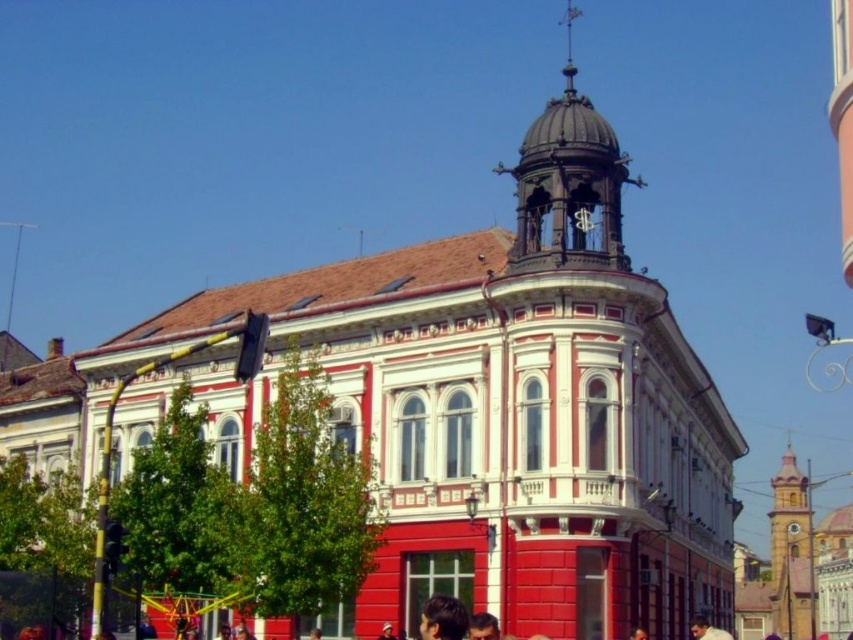
You are an architect examining the building. You notice the polished brass bell tower at upper center and the brick clock tower at right. Which one is located higher up in the building?

The polished brass bell tower at upper center is positioned over the brick clock tower at right, so it is higher up in the building.

You are a drone operator tasked with capturing aerial footage of the building. Your drone has a maximum flight range of 80 meters from its starting position. If you position the drone at the polished brass bell tower at upper center, can it reach the brick clock tower at right without exceeding its range limit?

The distance between the polished brass bell tower at upper center and the brick clock tower at right is 82.71 meters, which exceeds the drone operator maximum flight range of 80 meters. The drone cannot reach the brick clock tower at right without exceeding its range limit.